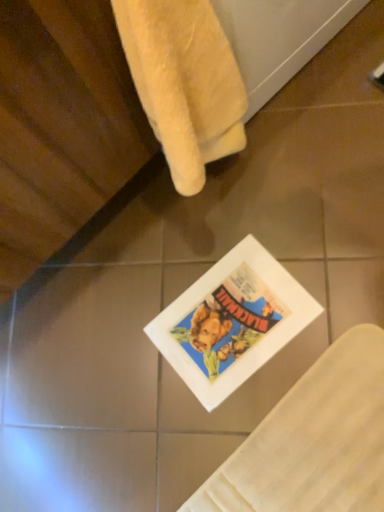
I want to click on vacant area that lies to the right of matte paper comic book at center, so click(x=314, y=242).